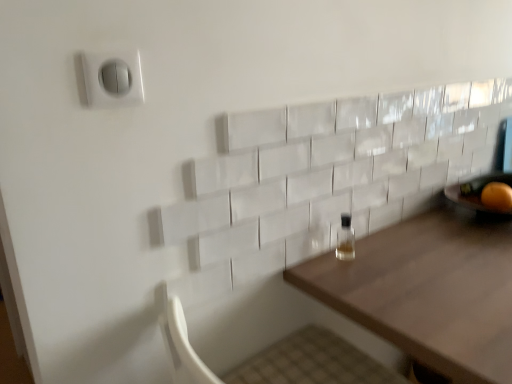
Where is `vacant region to the left of orange matte at right`? The width and height of the screenshot is (512, 384). vacant region to the left of orange matte at right is located at coordinates (463, 209).